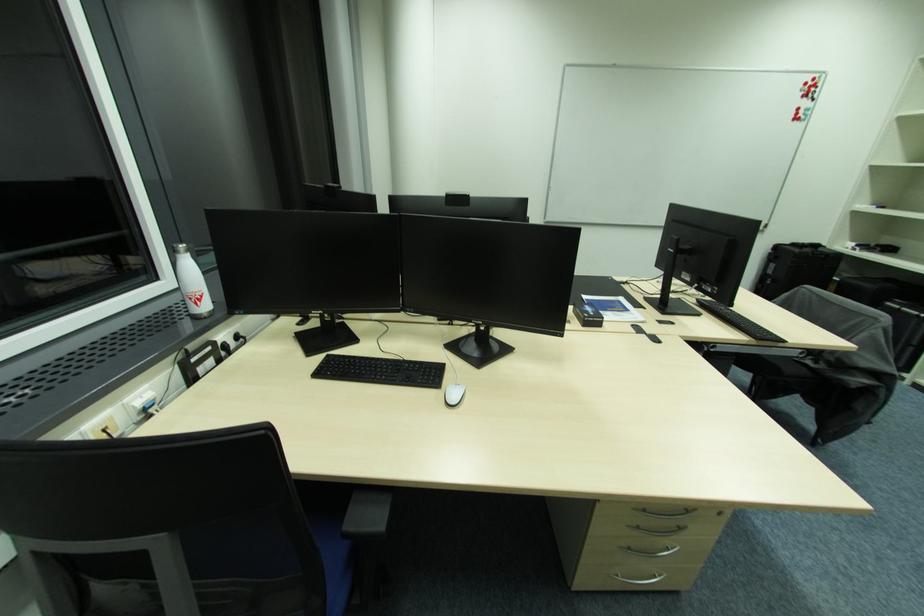
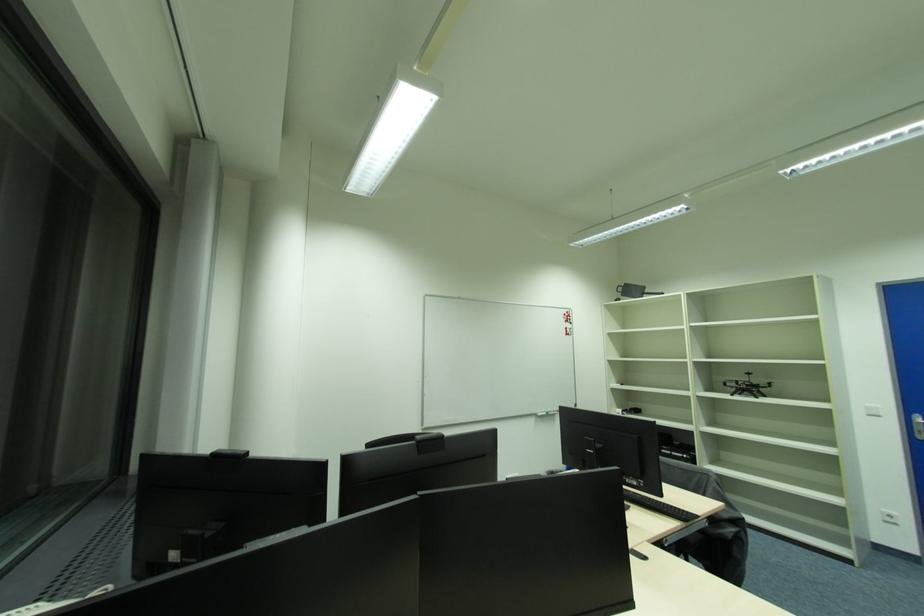
The images are taken continuously from a first-person perspective. In which direction is your viewpoint rotating?

The camera's rotation is toward right-up.